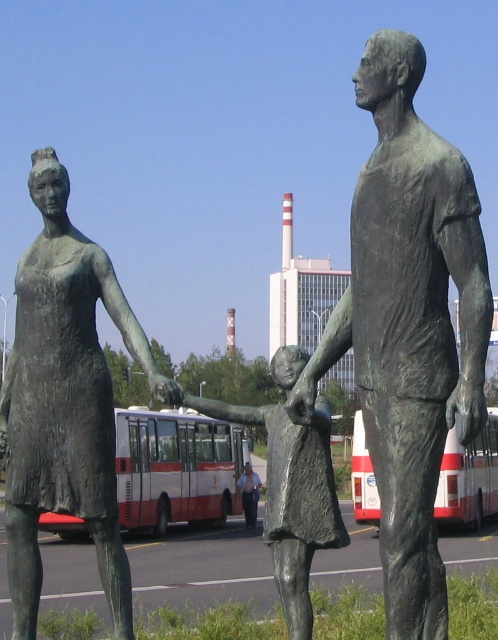
Question: Which of the following is the farthest from the observer?

Choices:
 (A) (123, 426)
 (B) (115, 433)
 (C) (357, 260)
 (D) (249, 504)

Answer: (D)

Question: Considering the relative positions of white matte bus at center and white/red painted bus at center in the image provided, where is white matte bus at center located with respect to white/red painted bus at center?

Choices:
 (A) above
 (B) below

Answer: (B)

Question: Which object is positioned farthest from the bronze statue at left?

Choices:
 (A) bronze statue of child at center
 (B) white matte bus at center
 (C) light blue shirt at center
 (D) white/red painted bus at center

Answer: (C)

Question: Can you confirm if bronze statue at left is positioned below bronze statue of child at center?

Choices:
 (A) yes
 (B) no

Answer: (A)

Question: Which point appears closest to the camera in this image?

Choices:
 (A) pos(45,524)
 (B) pos(247,520)

Answer: (A)

Question: Does bronze statue at left have a smaller size compared to white matte bus at center?

Choices:
 (A) no
 (B) yes

Answer: (B)